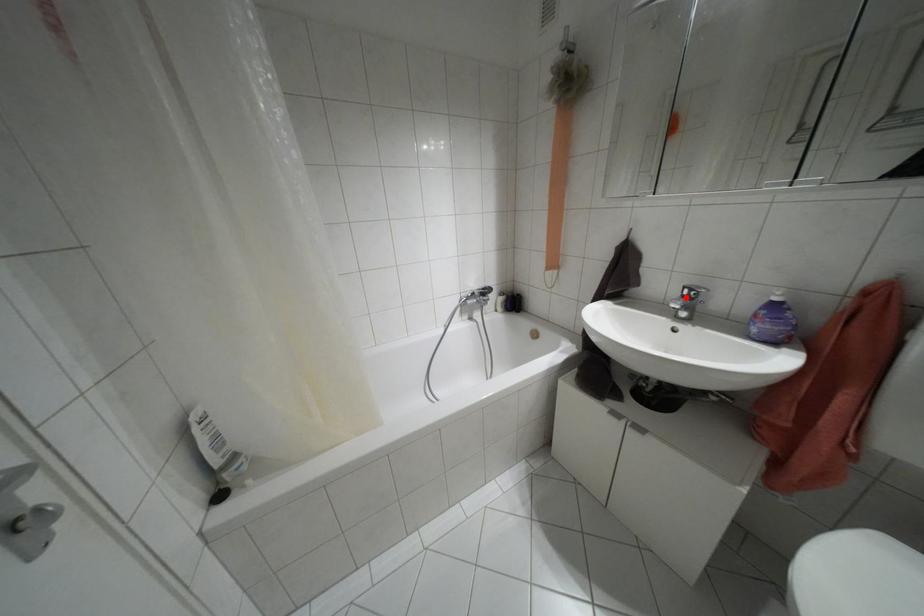
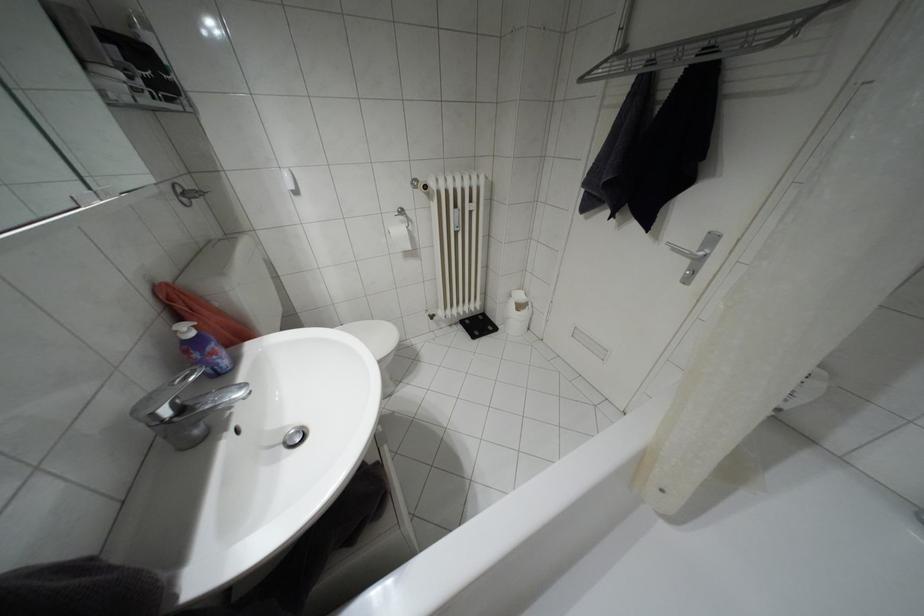
Where in the second image is the point corresponding to the highlighted location from the first image?

(180, 408)